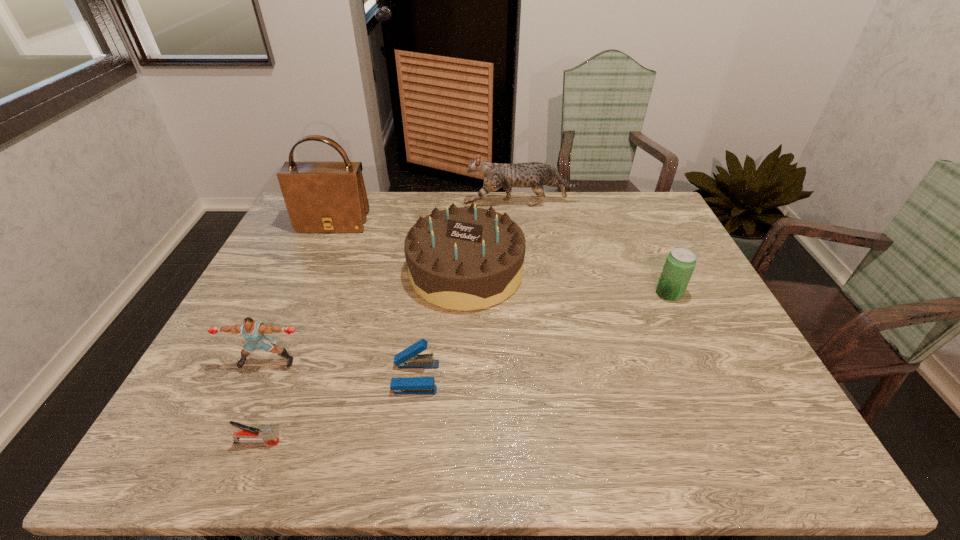
Find the location of a particular element. The width and height of the screenshot is (960, 540). free space located on the face of the farthest object is located at coordinates (366, 204).

You are a GUI agent. You are given a task and a screenshot of the screen. Output one action in this format:
    pyautogui.click(x=<x>, y=<y>)
    Task: Click on the blank space located on the face of the farthest object
    
    Given the screenshot: What is the action you would take?
    pyautogui.click(x=424, y=204)

Where is `vacant space located on the face of the farthest object`? vacant space located on the face of the farthest object is located at coordinates (357, 204).

Identify the location of vacant position located on the front-facing side of the birthday cake. The height and width of the screenshot is (540, 960). (463, 364).

Image resolution: width=960 pixels, height=540 pixels. In order to click on vacant area situated on the front-facing side of the puncher in this screenshot , I will do `click(235, 432)`.

Where is `free region located on the left of the soda`? The height and width of the screenshot is (540, 960). free region located on the left of the soda is located at coordinates (609, 294).

What are the coordinates of `vacant space situated 0.400m on the right of the farther stapler` in the screenshot? It's located at (612, 377).

In order to click on free space located on the handle side of the nearest object in this screenshot , I will do `click(308, 442)`.

This screenshot has width=960, height=540. What are the coordinates of `shoulder bag that is at the far edge` in the screenshot? It's located at (320, 196).

Where is `cat situated at the far edge`? cat situated at the far edge is located at coordinates (534, 175).